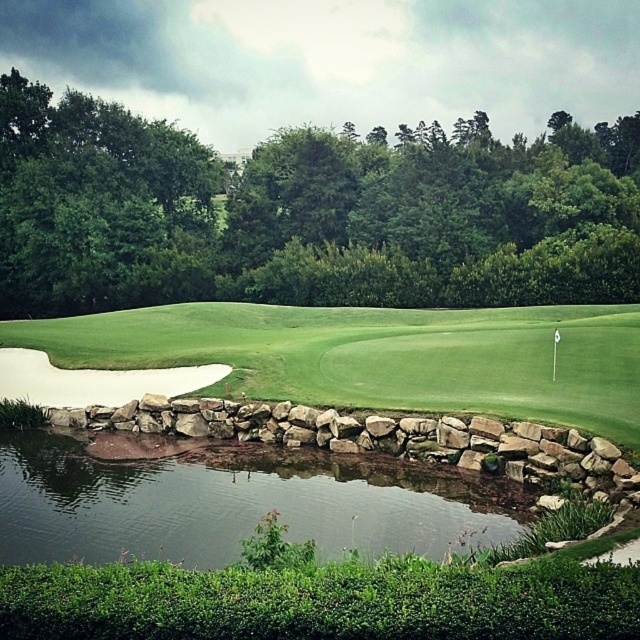
Is green grassy golf course at center closer to the viewer compared to clear water at pond center?

No, green grassy golf course at center is behind clear water at pond center.

Can you confirm if green grassy golf course at center is thinner than clear water at pond center?

No, green grassy golf course at center is not thinner than clear water at pond center.

What do you see at coordinates (378, 355) in the screenshot?
I see `green grassy golf course at center` at bounding box center [378, 355].

Find the location of a particular element. The image size is (640, 640). green grassy golf course at center is located at coordinates (378, 355).

Does green leafy tree at upper center have a greater width compared to green grassy golf course at center?

Correct, the width of green leafy tree at upper center exceeds that of green grassy golf course at center.

Between green leafy tree at upper center and green grassy golf course at center, which one appears on the left side from the viewer's perspective?

green grassy golf course at center is more to the left.

Is point (560, 227) closer to viewer compared to point (230, 372)?

No, (560, 227) is behind (230, 372).

The image size is (640, 640). What are the coordinates of `green leafy tree at upper center` in the screenshot? It's located at (307, 212).

In the scene shown: Does green leafy tree at upper center appear on the left side of clear water at pond center?

No, green leafy tree at upper center is not to the left of clear water at pond center.

In the scene shown: Who is lower down, green leafy tree at upper center or clear water at pond center?

clear water at pond center is below.

Which is behind, point (577, 250) or point (356, 483)?

The point (577, 250) is more distant.

You are a GUI agent. You are given a task and a screenshot of the screen. Output one action in this format:
    pyautogui.click(x=<x>, y=<y>)
    Task: Click on the green leafy tree at upper center
    
    Given the screenshot: What is the action you would take?
    pyautogui.click(x=307, y=212)